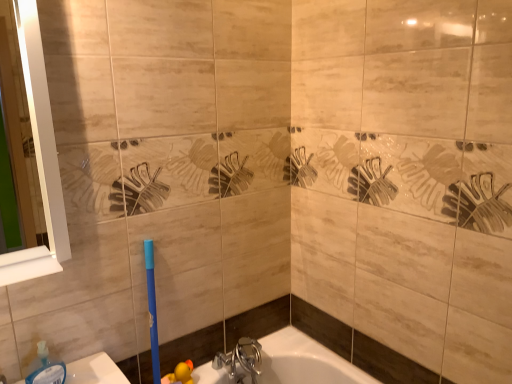
Question: Is chrome metallic faucet at lower center aimed at translucent plastic soap dispenser at lower left?

Choices:
 (A) yes
 (B) no

Answer: (B)

Question: Is chrome metallic faucet at lower center positioned beyond the bounds of translucent plastic soap dispenser at lower left?

Choices:
 (A) no
 (B) yes

Answer: (B)

Question: Can you confirm if chrome metallic faucet at lower center is taller than translucent plastic soap dispenser at lower left?

Choices:
 (A) no
 (B) yes

Answer: (B)

Question: Is chrome metallic faucet at lower center bigger than translucent plastic soap dispenser at lower left?

Choices:
 (A) yes
 (B) no

Answer: (A)

Question: Considering the relative positions of chrome metallic faucet at lower center and translucent plastic soap dispenser at lower left in the image provided, is chrome metallic faucet at lower center to the left of translucent plastic soap dispenser at lower left from the viewer's perspective?

Choices:
 (A) no
 (B) yes

Answer: (A)

Question: From a real-world perspective, is chrome metallic faucet at lower center physically located above or below white glossy mirror at left?

Choices:
 (A) below
 (B) above

Answer: (A)

Question: Is chrome metallic faucet at lower center wider or thinner than white glossy mirror at left?

Choices:
 (A) wide
 (B) thin

Answer: (A)

Question: From the image's perspective, is chrome metallic faucet at lower center above or below white glossy mirror at left?

Choices:
 (A) below
 (B) above

Answer: (A)

Question: Is chrome metallic faucet at lower center spatially inside white glossy mirror at left, or outside of it?

Choices:
 (A) outside
 (B) inside

Answer: (A)

Question: Considering the positions of white glossy mirror at left and chrome metallic faucet at lower center in the image, is white glossy mirror at left wider or thinner than chrome metallic faucet at lower center?

Choices:
 (A) thin
 (B) wide

Answer: (A)

Question: Does point (38, 99) appear closer or farther from the camera than point (221, 354)?

Choices:
 (A) farther
 (B) closer

Answer: (B)

Question: Choose the correct answer: Is white glossy mirror at left inside chrome metallic faucet at lower center or outside it?

Choices:
 (A) inside
 (B) outside

Answer: (B)

Question: From a real-world perspective, is white glossy mirror at left physically located above or below chrome metallic faucet at lower center?

Choices:
 (A) above
 (B) below

Answer: (A)

Question: In terms of height, does translucent plastic soap dispenser at lower left look taller or shorter compared to chrome metallic faucet at lower center?

Choices:
 (A) short
 (B) tall

Answer: (A)

Question: Which is correct: translucent plastic soap dispenser at lower left is inside chrome metallic faucet at lower center, or outside of it?

Choices:
 (A) outside
 (B) inside

Answer: (A)